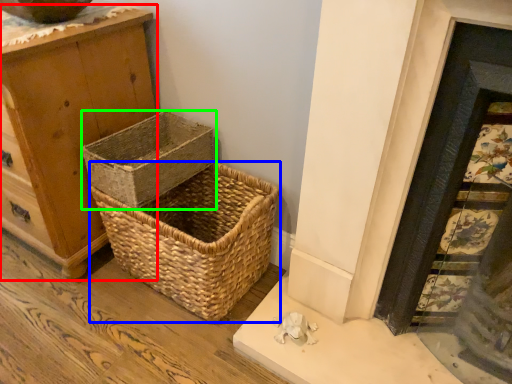
Question: Considering the real-world distances, which object is closest to chest of drawers (highlighted by a red box)? picnic basket (highlighted by a blue box) or picnic basket (highlighted by a green box).

Choices:
 (A) picnic basket
 (B) picnic basket

Answer: (B)